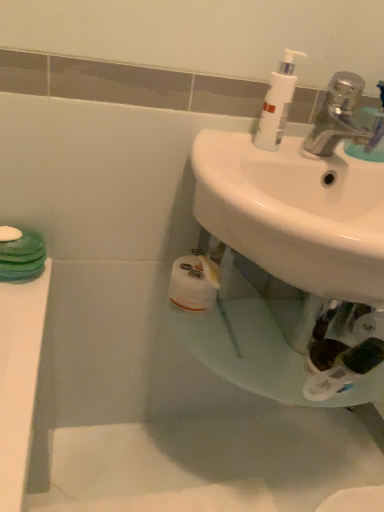
Where is `free location to the right of white plastic pump bottle at upper right`? free location to the right of white plastic pump bottle at upper right is located at coordinates (322, 153).